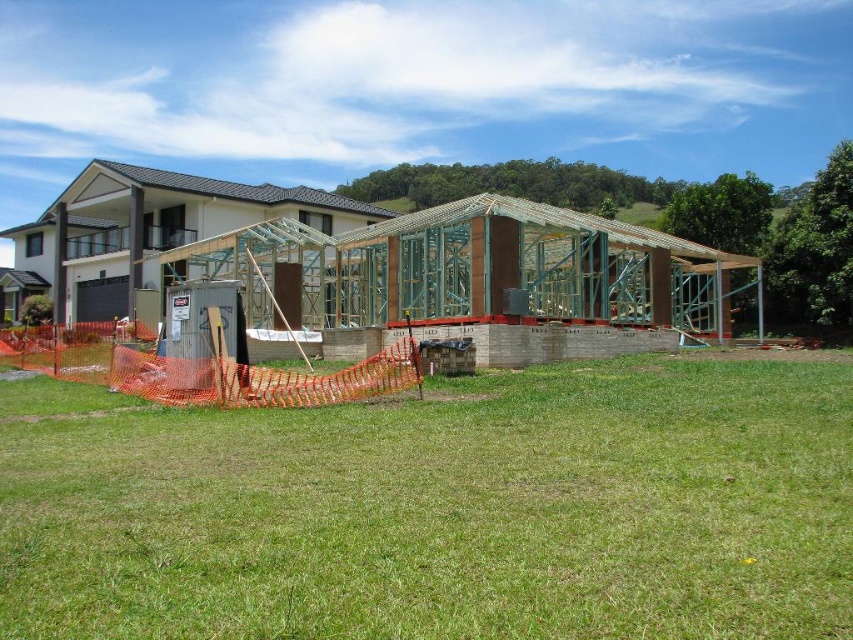
Can you confirm if green grass at center is positioned to the right of wooden frame house under construction at center?

Correct, you'll find green grass at center to the right of wooden frame house under construction at center.

Based on the photo, is green grass at center above wooden frame house under construction at center?

No, green grass at center is not above wooden frame house under construction at center.

Does point (316, 620) lie behind point (544, 314)?

No, (316, 620) is in front of (544, 314).

Image resolution: width=853 pixels, height=640 pixels. I want to click on green grass at center, so click(439, 508).